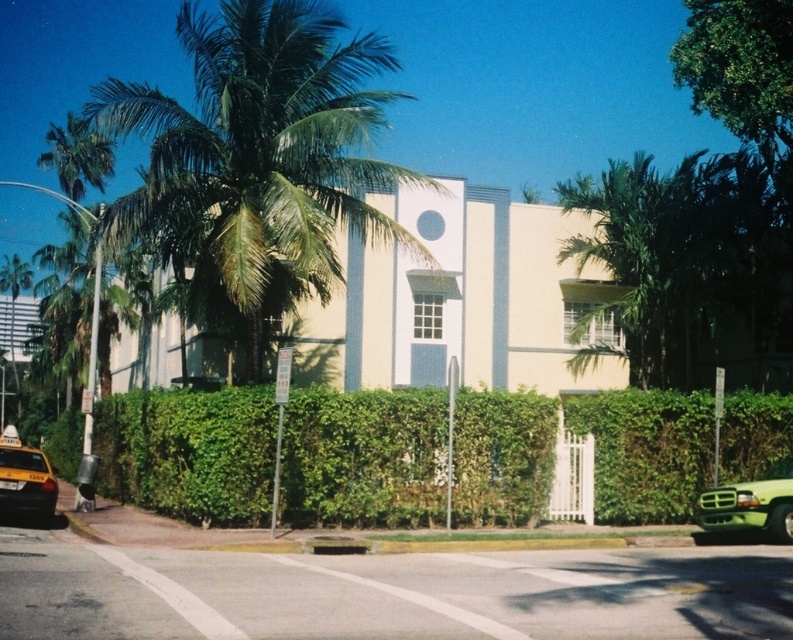
You are standing at the crosswalk on the street in front of the building. You want to take a photo of the building without the green leafy hedge at center blocking the view. Where should you position yourself relative to the hedge?

To avoid the green leafy hedge at center blocking the view of the building, you should position yourself to the left side of the hedge since the hedge is located at point [362,458], which is to the right of the center. By moving to the left side, you can capture the building without obstruction.

You are a delivery person who needs to park your green matte truck at lower right near the green leafy palm tree at upper left. Given the distance between them is 16.68 meters, can you safely make the delivery without crossing the crosswalk in the foreground?

The distance between the green leafy palm tree at upper left and the green matte truck at lower right is 16.68 meters. Since the crosswalk is in the foreground, you should avoid crossing it to make the delivery safely.

You are standing at the point marked as point (257, 161). What object are you on?

You are on the green leafy palm tree at upper left.